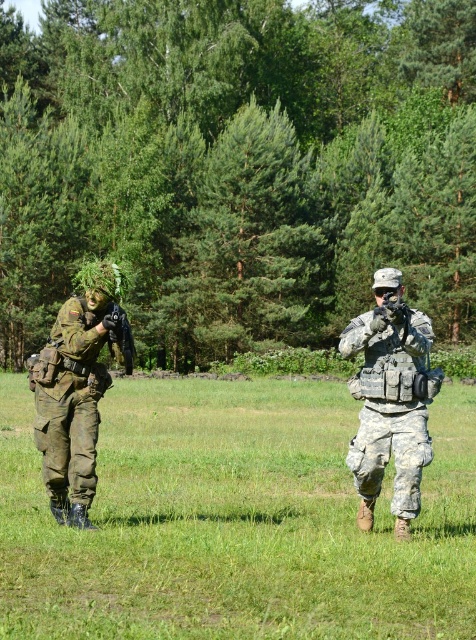
You are a military observer analyzing the scene. You notice the camouflage fabric pants at center and the black matte rifle at center. Which object is positioned lower in the image?

The camouflage fabric pants at center is located below the black matte rifle at center, so it is positioned lower in the image.

You are a photographer aiming to capture a clear shot of the camouflage fabric pants at center and the black matte rifle at center. Which object should you focus on first to ensure both are in focus?

The camouflage fabric pants at center is closer to the viewer than the black matte rifle at center. To ensure both are in focus, you should focus on the camouflage fabric pants at center first, as it is the closer object.

Consider the image. You are a photographer trying to capture a clear photo of the black matte rifle at center. The camouflage fabric uniform at center is blocking your view. Can you estimate if the rifle is shorter than the uniform?

The camouflage fabric uniform at center is taller than black matte rifle at center, so yes, the rifle is shorter than the uniform.